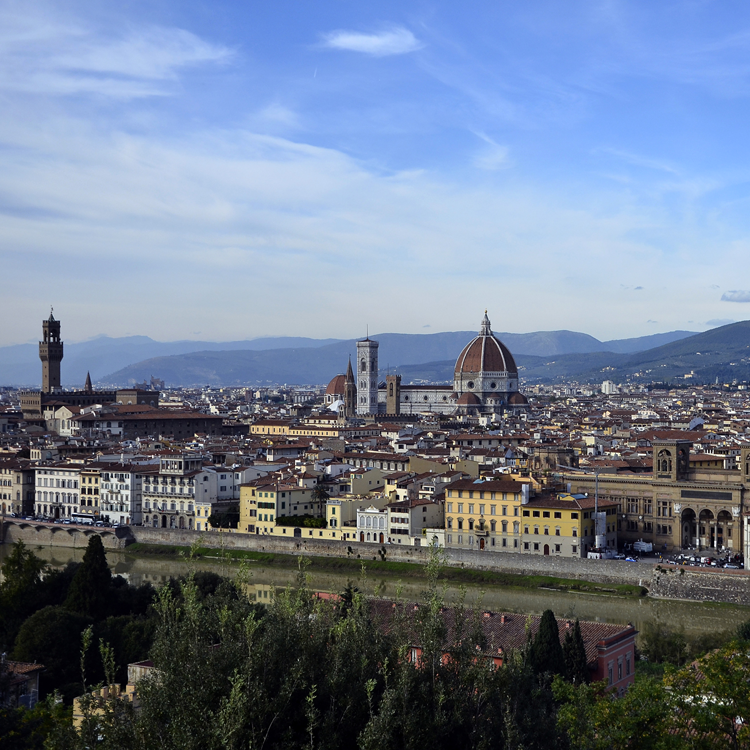
Find the location of a particular element. windows is located at coordinates (363, 364), (220, 476), (502, 511), (574, 534).